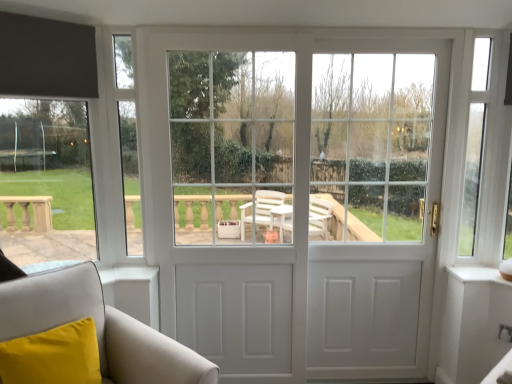
Question: Does white leather armchair at lower left have a lesser height compared to white glossy door at center, which is the second screen door in right-to-left order?

Choices:
 (A) no
 (B) yes

Answer: (B)

Question: From a real-world perspective, is white leather armchair at lower left positioned under white glossy door at center, positioned as the 1th screen door in left-to-right order, based on gravity?

Choices:
 (A) no
 (B) yes

Answer: (B)

Question: Is white glossy door at center, positioned as the 1th screen door in left-to-right order, a part of white leather armchair at lower left?

Choices:
 (A) yes
 (B) no

Answer: (B)

Question: Is white leather armchair at lower left taller than white glossy door at center, which is the second screen door in right-to-left order?

Choices:
 (A) no
 (B) yes

Answer: (A)

Question: Can you confirm if white leather armchair at lower left is positioned to the left of white glossy door at center, which is the second screen door in right-to-left order?

Choices:
 (A) no
 (B) yes

Answer: (B)

Question: Can we say white leather armchair at lower left lies outside white glossy door at center, positioned as the 1th screen door in left-to-right order?

Choices:
 (A) yes
 (B) no

Answer: (A)

Question: Can you confirm if white matte door at center is taller than white glossy door at right, which is the 1th screen door from right to left?

Choices:
 (A) yes
 (B) no

Answer: (A)

Question: Is white matte door at center at the right side of white glossy door at right, which ranks as the second screen door in left-to-right order?

Choices:
 (A) yes
 (B) no

Answer: (B)

Question: Is white matte door at center with white glossy door at right, which is the 1th screen door from right to left?

Choices:
 (A) no
 (B) yes

Answer: (A)

Question: Can you confirm if white matte door at center is smaller than white glossy door at right, which is the 1th screen door from right to left?

Choices:
 (A) no
 (B) yes

Answer: (A)

Question: Can you confirm if white matte door at center is wider than white glossy door at right, which ranks as the second screen door in left-to-right order?

Choices:
 (A) yes
 (B) no

Answer: (B)

Question: Does white matte door at center lie in front of white glossy door at right, which is the 1th screen door from right to left?

Choices:
 (A) no
 (B) yes

Answer: (B)

Question: Considering the relative sizes of white glossy door at right, which ranks as the second screen door in left-to-right order, and white glossy door at center, which is the second screen door in right-to-left order, in the image provided, is white glossy door at right, which ranks as the second screen door in left-to-right order, taller than white glossy door at center, which is the second screen door in right-to-left order,?

Choices:
 (A) yes
 (B) no

Answer: (B)